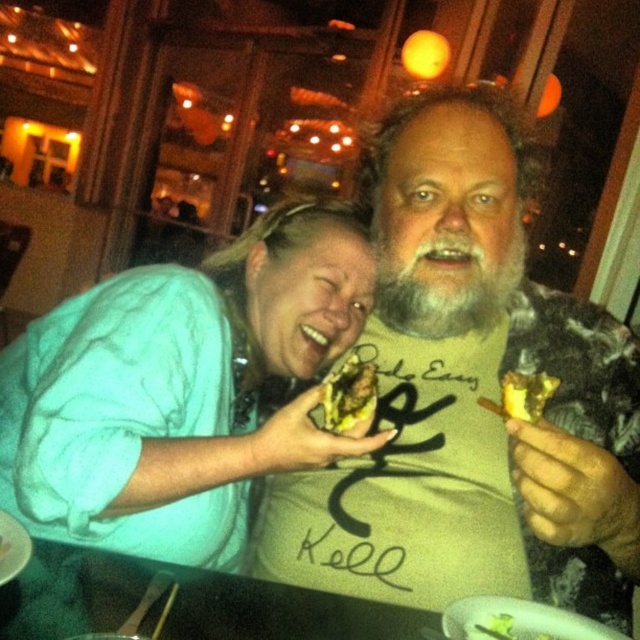
You are a photographer standing at the camera position. You want to take a photo of the golden crispy chicken at center. The chicken is currently 30.34 inches away from the camera. If you move the camera 10 inches closer to the chicken, how far will the chicken be from the camera?

The golden crispy chicken at center and camera are initially 30.34 inches apart. Moving the camera 10 inches closer reduces the distance to 20.34 inches. The chicken will then be 20.34 inches away from the camera.

You are a photographer trying to capture a candid shot of the graybeard at center and the golden crispy chicken at center. Since you want to ensure both subjects are in focus, you need to know their relative sizes. Which one is taller?

The graybeard at center is taller than the golden crispy chicken at center.